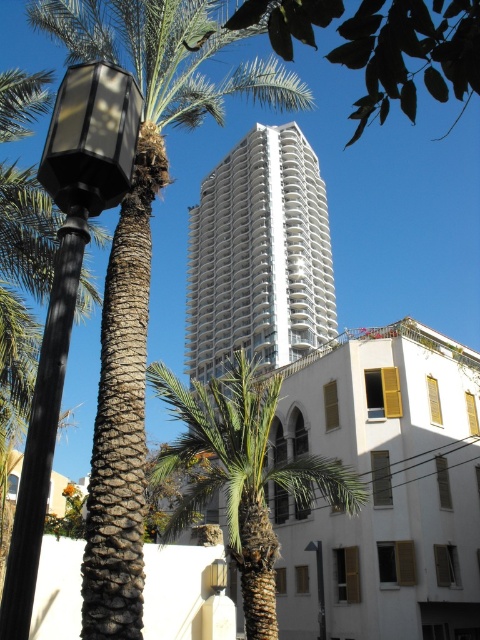
Question: Which point is closer to the camera?

Choices:
 (A) white smooth building at center
 (B) metallic gray streetlamp at center
 (C) brown textured palm tree at left
 (D) black polished pole at left

Answer: (D)

Question: Does white smooth building at center appear on the right side of black polished pole at left?

Choices:
 (A) yes
 (B) no

Answer: (B)

Question: Does green leafy tree at upper center have a greater width compared to metallic gray streetlamp at center?

Choices:
 (A) no
 (B) yes

Answer: (B)

Question: Which point is farther from the camera taking this photo?

Choices:
 (A) (116, 225)
 (B) (22, 524)

Answer: (A)

Question: Can you confirm if matte black lamp post at left is positioned above green textured palm tree at center?

Choices:
 (A) yes
 (B) no

Answer: (A)

Question: Which object is the closest to the brown textured palm tree at left?

Choices:
 (A) matte black lamp post at left
 (B) black polished pole at left
 (C) green textured palm tree at center

Answer: (C)